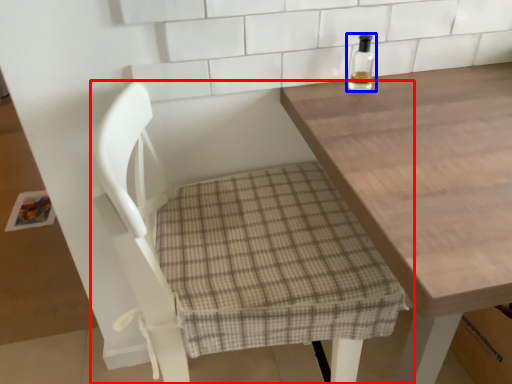
Question: Which object appears closest to the camera in this image, chair (highlighted by a red box) or bottle (highlighted by a blue box)?

Choices:
 (A) chair
 (B) bottle

Answer: (A)